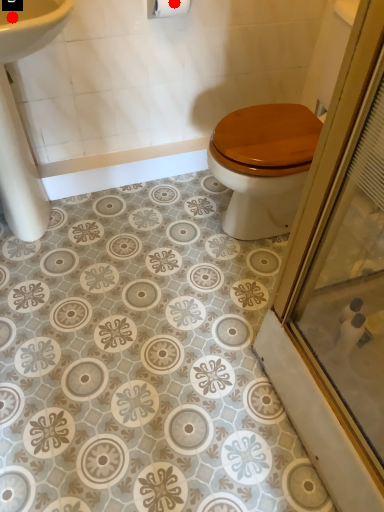
Question: Two points are circled on the image, labeled by A and B beside each circle. Which point is farther from the camera taking this photo?

Choices:
 (A) A is further
 (B) B is further

Answer: (A)